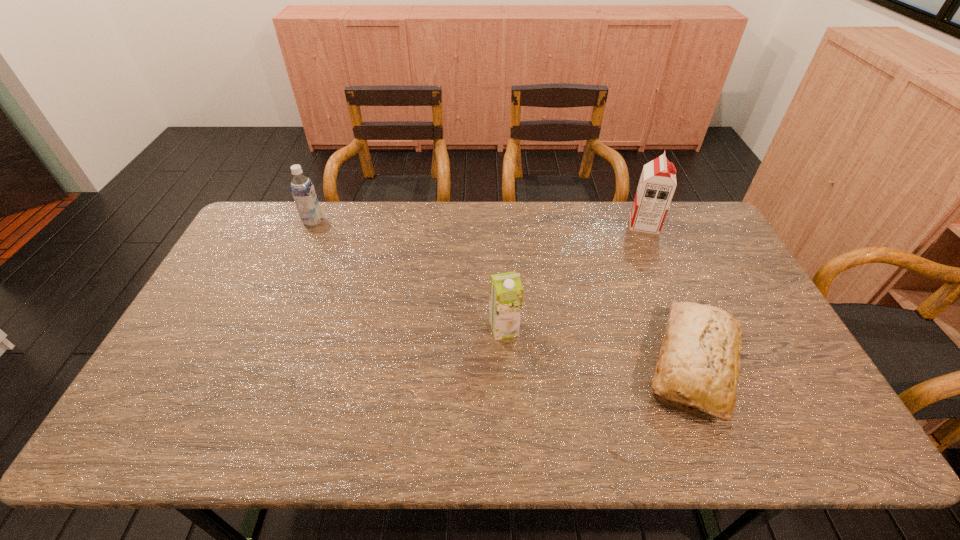
Locate an element on the screen. free spot between the second soya milk from left to right and the shortest object is located at coordinates (598, 347).

Where is `free space between the second soya milk from right to left and the tallest object`? free space between the second soya milk from right to left and the tallest object is located at coordinates (574, 276).

Find the location of a particular element. The image size is (960, 540). empty location between the leftmost soya milk and the second object from left to right is located at coordinates (409, 275).

Find the location of a particular element. The height and width of the screenshot is (540, 960). vacant point located between the rightmost soya milk and the shortest object is located at coordinates (668, 295).

You are a GUI agent. You are given a task and a screenshot of the screen. Output one action in this format:
    pyautogui.click(x=<x>, y=<y>)
    Task: Click on the free space between the second soya milk from left to right and the leftmost object
    Image resolution: width=960 pixels, height=540 pixels.
    Given the screenshot: What is the action you would take?
    pyautogui.click(x=409, y=275)

At what (x,y) coordinates should I click in order to perform the action: click on free space between the rightmost soya milk and the nearest soya milk. Please return your answer as a coordinate pair (x, y). This screenshot has width=960, height=540. Looking at the image, I should click on (574, 276).

Where is `free space between the third object from right to left and the rightmost soya milk`? The width and height of the screenshot is (960, 540). free space between the third object from right to left and the rightmost soya milk is located at coordinates (574, 276).

Identify which object is the second nearest to the leftmost object. Please provide its 2D coordinates. Your answer should be formatted as a tuple, i.e. [(x, y)], where the tuple contains the x and y coordinates of a point satisfying the conditions above.

[(699, 358)]

Locate an element on the screen. This screenshot has width=960, height=540. the closest object relative to the shortest object is located at coordinates (506, 291).

Choose which soya milk is the second nearest neighbor to the shortest object. Please provide its 2D coordinates. Your answer should be formatted as a tuple, i.e. [(x, y)], where the tuple contains the x and y coordinates of a point satisfying the conditions above.

[(657, 184)]